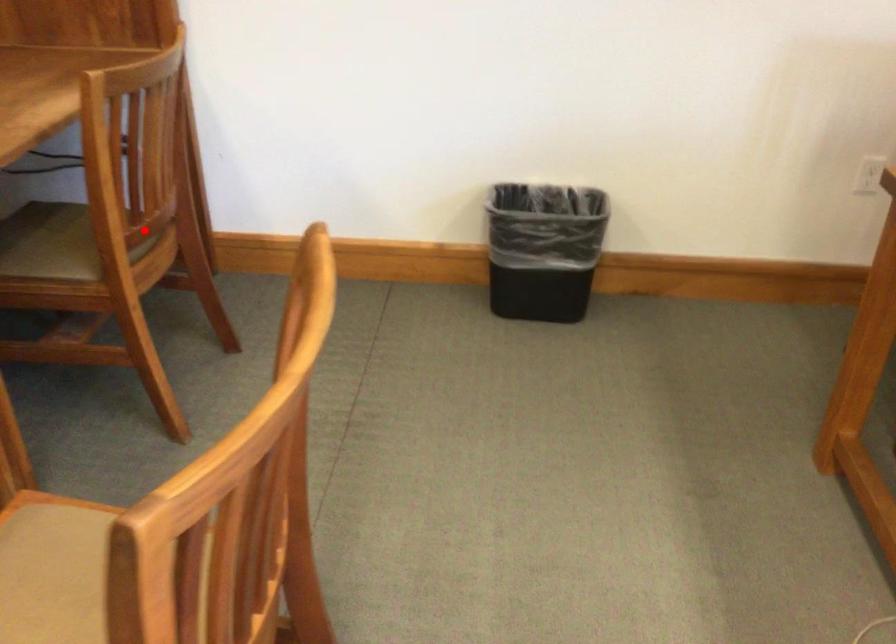
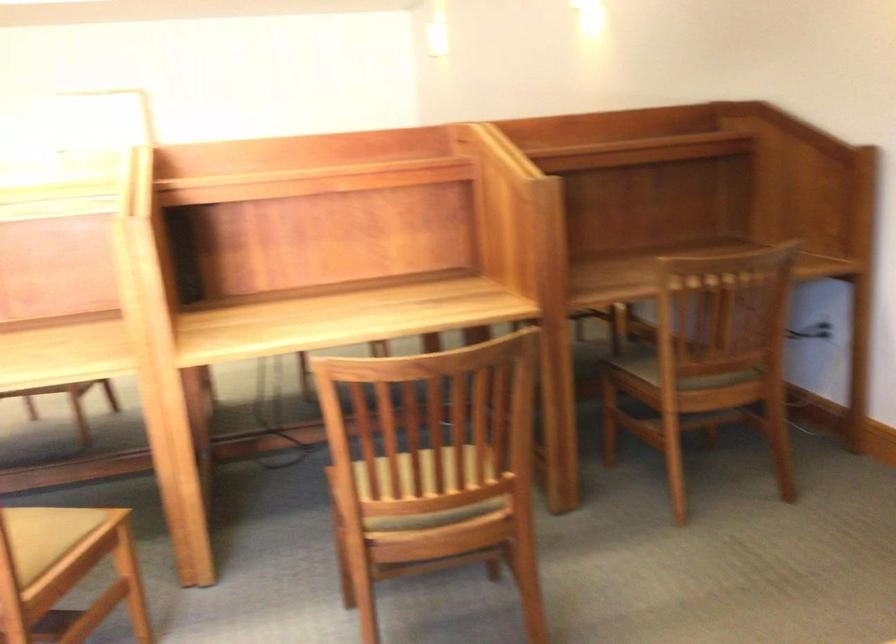
Where in the second image is the point corresponding to the highlighted location from the first image?

(698, 361)